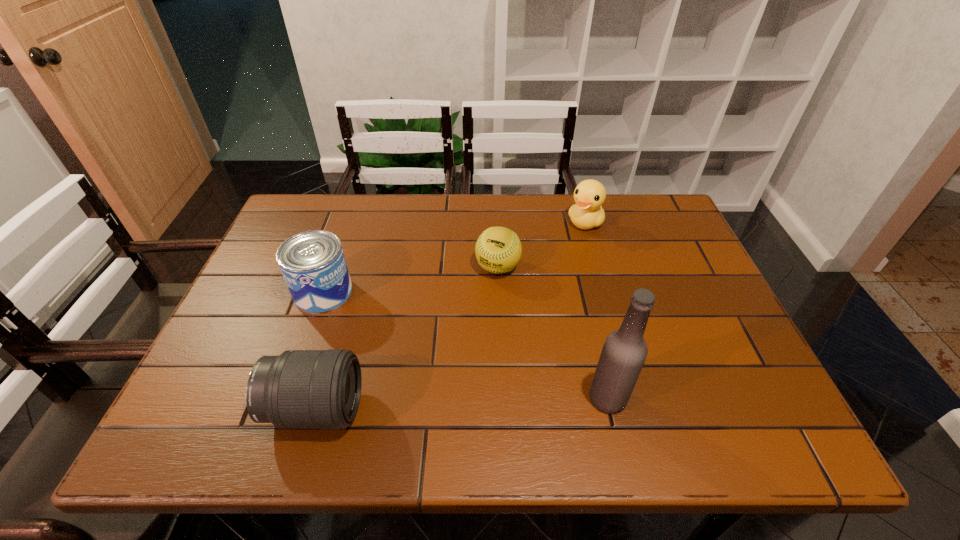
This screenshot has height=540, width=960. Find the location of `vacant space in between the duck and the can`. vacant space in between the duck and the can is located at coordinates (454, 257).

Identify the location of free space between the can and the beer bottle. This screenshot has height=540, width=960. (466, 345).

Locate an element on the screen. The image size is (960, 540). unoccupied area between the can and the duck is located at coordinates (454, 257).

Where is `empty location between the telephoto lens and the third object from right to left`? empty location between the telephoto lens and the third object from right to left is located at coordinates (406, 338).

You are a GUI agent. You are given a task and a screenshot of the screen. Output one action in this format:
    pyautogui.click(x=<x>, y=<y>)
    Task: Click on the vacant space that is in between the duck and the tallest object
    The width and height of the screenshot is (960, 540).
    Given the screenshot: What is the action you would take?
    pyautogui.click(x=596, y=310)

At what (x,y) coordinates should I click in order to perform the action: click on free space between the farthest object and the third object from left to right. Please return your answer as a coordinate pair (x, y). This screenshot has width=960, height=540. Looking at the image, I should click on (541, 245).

I want to click on object identified as the second closest to the telephoto lens, so click(x=498, y=250).

Identify which object is the third nearest to the tallest object. Please provide its 2D coordinates. Your answer should be formatted as a tuple, i.e. [(x, y)], where the tuple contains the x and y coordinates of a point satisfying the conditions above.

[(589, 195)]

Identify the location of vacant space that satisfies the following two spatial constraints: 1. on the back side of the farthest object; 2. on the left side of the can. This screenshot has width=960, height=540. (348, 222).

You are a GUI agent. You are given a task and a screenshot of the screen. Output one action in this format:
    pyautogui.click(x=<x>, y=<y>)
    Task: Click on the vacant region that satisfies the following two spatial constraints: 1. on the back side of the softball; 2. on the left side of the can
    
    Given the screenshot: What is the action you would take?
    pyautogui.click(x=332, y=267)